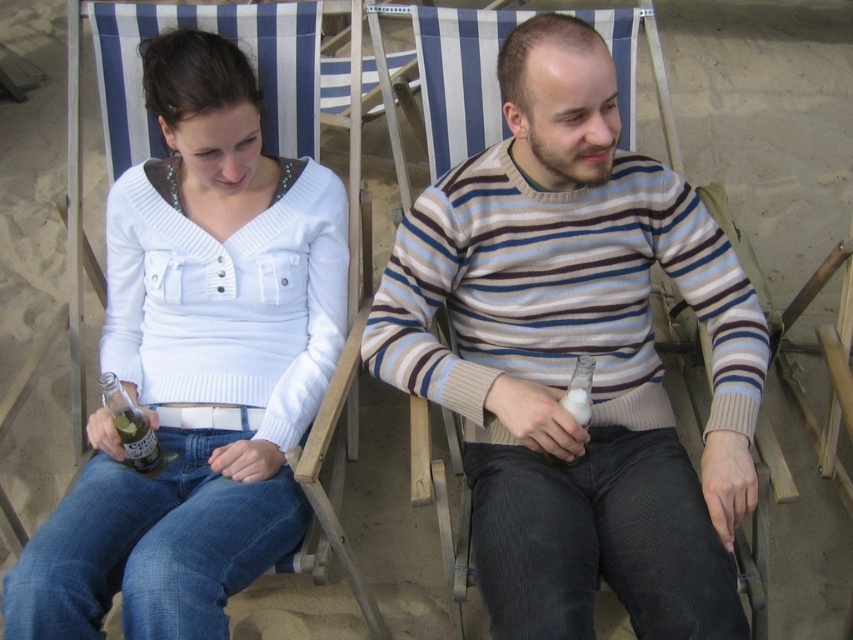
Question: From the image, what is the correct spatial relationship of white matte sweater at upper left in relation to clear glass bottle at center?

Choices:
 (A) left
 (B) right

Answer: (A)

Question: Which point is farther from the camera taking this photo?

Choices:
 (A) (138, 432)
 (B) (160, 61)
 (C) (584, 403)

Answer: (B)

Question: Does clear glass bottle at lower left appear under clear glass bottle at center?

Choices:
 (A) yes
 (B) no

Answer: (A)

Question: Which object is closer to the camera taking this photo?

Choices:
 (A) white matte sweater at upper left
 (B) clear glass bottle at center
 (C) striped sweater at center

Answer: (C)

Question: Can you confirm if clear glass bottle at lower left is positioned to the left of clear glass bottle at center?

Choices:
 (A) yes
 (B) no

Answer: (A)

Question: Which point is closer to the camera?

Choices:
 (A) clear glass bottle at center
 (B) striped sweater at center
 (C) clear glass bottle at lower left
 (D) white matte sweater at upper left

Answer: (B)